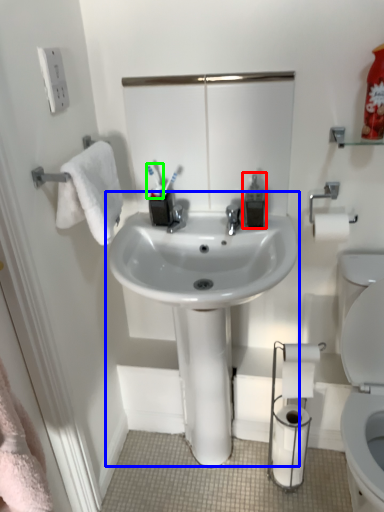
Question: Which object is the closest to the soap dispenser (highlighted by a red box)? Choose among these: sink (highlighted by a blue box) or toothbrush (highlighted by a green box).

Choices:
 (A) sink
 (B) toothbrush

Answer: (B)